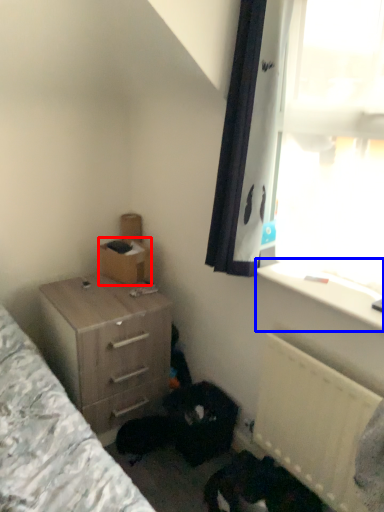
Question: Which object appears farthest to the camera in this image, box (highlighted by a red box) or window sill (highlighted by a blue box)?

Choices:
 (A) box
 (B) window sill

Answer: (A)